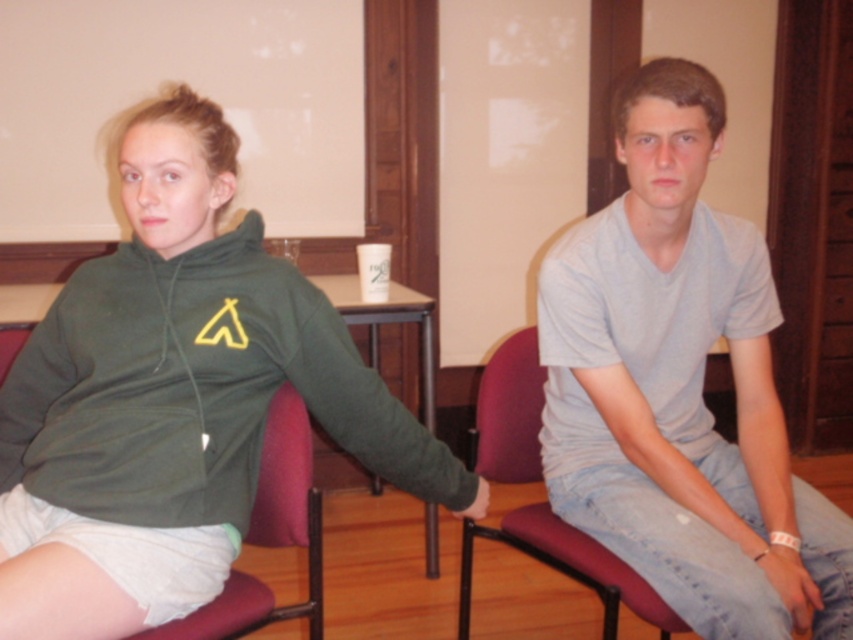
Question: Which point is closer to the camera taking this photo?

Choices:
 (A) (299, 410)
 (B) (654, 170)
 (C) (473, 460)

Answer: (B)

Question: Among these points, which one is farthest from the camera?

Choices:
 (A) (709, 509)
 (B) (311, 394)

Answer: (B)

Question: Is green matte hoodie at left above velvet-like fabric armchair at center-left?

Choices:
 (A) no
 (B) yes

Answer: (B)

Question: Is green matte hoodie at left bigger than gray cotton t-shirt at center?

Choices:
 (A) no
 (B) yes

Answer: (B)

Question: Which point is farther to the camera?

Choices:
 (A) velvet-like fabric armchair at center-left
 (B) gray cotton t-shirt at center
 (C) green matte hoodie at left

Answer: (B)

Question: Does matte plastic chair at center appear under velvet-like fabric armchair at center-left?

Choices:
 (A) no
 (B) yes

Answer: (B)